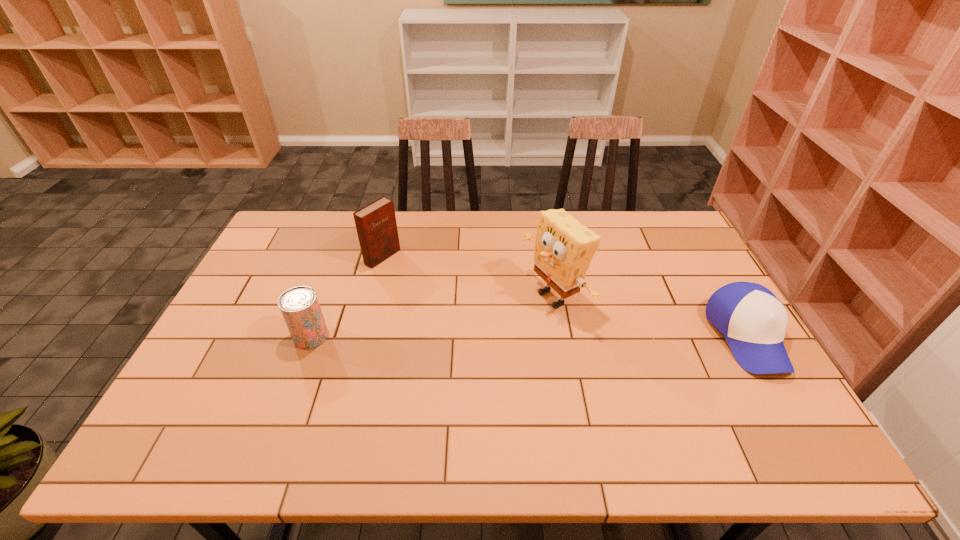
The image size is (960, 540). Find the location of `vacant space at the right edge of the desktop`. vacant space at the right edge of the desktop is located at coordinates coord(694,284).

In the image, there is a desktop. Where is `free space at the far right corner`? free space at the far right corner is located at coordinates (654, 241).

Find the location of `free space between the third object from left to right and the beer can`. free space between the third object from left to right and the beer can is located at coordinates (433, 317).

Locate an element on the screen. This screenshot has width=960, height=540. vacant point located between the leftmost object and the third shortest object is located at coordinates (347, 296).

At what (x,y) coordinates should I click in order to perform the action: click on free space between the beer can and the diary. Please return your answer as a coordinate pair (x, y). Looking at the image, I should click on (347, 296).

Image resolution: width=960 pixels, height=540 pixels. Find the location of `blank region between the leftmost object and the third object from right to left`. blank region between the leftmost object and the third object from right to left is located at coordinates (347, 296).

Where is `free space between the beer can and the third object from right to left`? This screenshot has height=540, width=960. free space between the beer can and the third object from right to left is located at coordinates (347, 296).

Where is `empty location between the second object from left to right and the beer can`? The height and width of the screenshot is (540, 960). empty location between the second object from left to right and the beer can is located at coordinates (347, 296).

Identify the location of vacant point located between the beer can and the tallest object. This screenshot has width=960, height=540. (433, 317).

Where is `object that is the second closest to the second tallest object`? The width and height of the screenshot is (960, 540). object that is the second closest to the second tallest object is located at coordinates (564, 248).